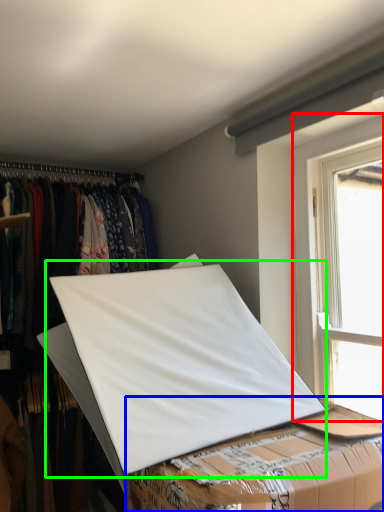
Question: Based on their relative distances, which object is farther from window (highlighted by a red box)? Choose from table (highlighted by a blue box) and linen (highlighted by a green box).

Choices:
 (A) table
 (B) linen

Answer: (A)